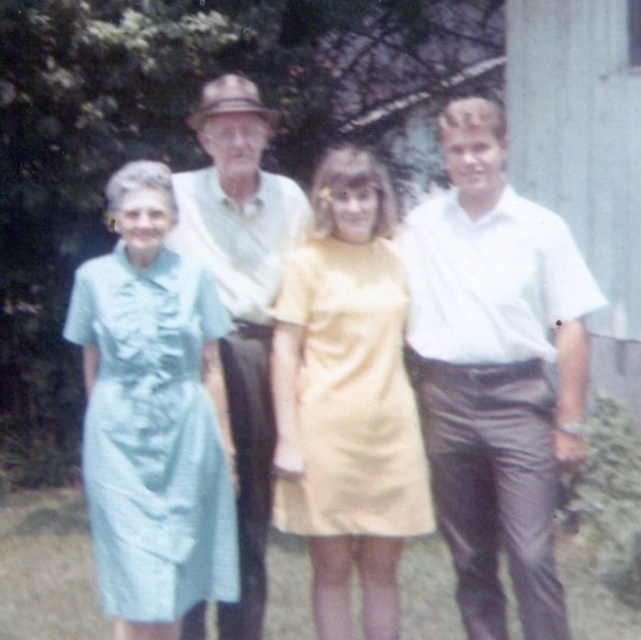
You are a photographer trying to capture a clear shot of the white smooth shirt at right and the light blue fabric dress at left. Which clothing item is covering part of the other in the image?

The white smooth shirt at right is positioned over the light blue fabric dress at left, so it is covering part of it.

You are a photographer trying to arrange the subjects in the image so that the white smooth shirt at right is above the light green fabric shirt at center. Is this arrangement possible based on their current positions?

The white smooth shirt at right is currently below the light green fabric shirt at center, so rearranging them to have the white smooth shirt at right above the light green fabric shirt at center would require changing their positions.